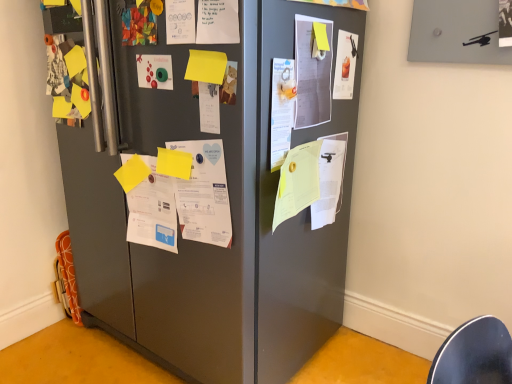
Identify the location of yellow matte paper at upper center, the fourth paper viewed from the left. Image resolution: width=512 pixels, height=384 pixels. (206, 66).

At what (x,y) coordinates should I click in order to perform the action: click on white paper at right, marked as the sixth paper in a left-to-right arrangement. Please return your answer as a coordinate pair (x, y). This screenshot has height=384, width=512. Looking at the image, I should click on (329, 180).

Identify the location of matte paper poster at upper right, the 1th poster positioned from the right. The width and height of the screenshot is (512, 384). (345, 65).

Describe the element at coordinates (179, 196) in the screenshot. The image size is (512, 384). I see `white paper at center, placed as the sixth poster when sorted from right to left` at that location.

This screenshot has height=384, width=512. Describe the element at coordinates (217, 22) in the screenshot. I see `white paper at center, the 4th poster from the right` at that location.

Where is `yellow matte paper at upper center, the third paper in the right-to-left sequence`? yellow matte paper at upper center, the third paper in the right-to-left sequence is located at coordinates (206, 66).

Which of these two, white paper at center, the sixth poster viewed from the left, or white paper at upper center, marked as the 7th poster in a right-to-left arrangement, is thinner?

white paper at center, the sixth poster viewed from the left, is thinner.

Is white paper at center, placed as the third poster when sorted from right to left, turned away from white paper at upper center, marked as the 7th poster in a right-to-left arrangement?

white paper at center, placed as the third poster when sorted from right to left, is not turned away from white paper at upper center, marked as the 7th poster in a right-to-left arrangement.

How different are the orientations of white paper at center, the sixth poster viewed from the left, and white paper at upper center, positioned as the 2th poster in left-to-right order, in degrees?

The angle between the facing direction of white paper at center, the sixth poster viewed from the left, and the facing direction of white paper at upper center, positioned as the 2th poster in left-to-right order, is 86.4 degrees.

In terms of height, does white paper at center, the sixth poster viewed from the left, look taller or shorter compared to white paper at upper center, marked as the 7th poster in a right-to-left arrangement?

Clearly, white paper at center, the sixth poster viewed from the left, is taller compared to white paper at upper center, marked as the 7th poster in a right-to-left arrangement.

Is point (334, 152) behind point (141, 204)?

Yes, it is.

Considering the sizes of white paper at right, marked as the sixth paper in a left-to-right arrangement, and white paper at center, marked as the 2th paper in a left-to-right arrangement, in the image, is white paper at right, marked as the sixth paper in a left-to-right arrangement, taller or shorter than white paper at center, marked as the 2th paper in a left-to-right arrangement,?

Clearly, white paper at right, marked as the sixth paper in a left-to-right arrangement, is taller compared to white paper at center, marked as the 2th paper in a left-to-right arrangement.

Is white paper at right, marked as the sixth paper in a left-to-right arrangement, oriented away from white paper at center, marked as the 2th paper in a left-to-right arrangement?

white paper at right, marked as the sixth paper in a left-to-right arrangement, is not turned away from white paper at center, marked as the 2th paper in a left-to-right arrangement.

Looking at this image, would you say white paper at right, marked as the sixth paper in a left-to-right arrangement, contains white paper at center, arranged as the fifth paper when viewed from the right?

No, white paper at center, arranged as the fifth paper when viewed from the right, is located outside of white paper at right, marked as the sixth paper in a left-to-right arrangement.

Which point is more forward, (x=209, y=73) or (x=318, y=27)?

The point (x=209, y=73) is in front.

Considering the sizes of objects yellow matte paper at upper center, the third paper in the right-to-left sequence, and yellow paper at upper center in the image provided, who is shorter, yellow matte paper at upper center, the third paper in the right-to-left sequence, or yellow paper at upper center?

yellow paper at upper center.

The image size is (512, 384). What are the coordinates of `note above the yellow matte paper at upper center, the fourth paper viewed from the left (from the image's perspective)` in the screenshot? It's located at (321, 37).

From a real-world perspective, is yellow matte paper at upper center, the fourth paper viewed from the left, on yellow paper at upper center?

No, from a real-world perspective, yellow matte paper at upper center, the fourth paper viewed from the left, is not on top of yellow paper at upper center.

Consider the image. Which of these two, yellow matte paper at center, the 3th paper when ordered from left to right, or white paper at center, placed as the third poster when sorted from right to left, is thinner?

Thinner between the two is white paper at center, placed as the third poster when sorted from right to left.

Considering the positions of objects yellow matte paper at center, the 3th paper when ordered from left to right, and white paper at center, the sixth poster viewed from the left, in the image provided, who is more to the left, yellow matte paper at center, the 3th paper when ordered from left to right, or white paper at center, the sixth poster viewed from the left,?

From the viewer's perspective, yellow matte paper at center, the 3th paper when ordered from left to right, appears more on the left side.

Is yellow matte paper at center, placed as the 4th paper when sorted from right to left, oriented towards white paper at center, the sixth poster viewed from the left?

No, yellow matte paper at center, placed as the 4th paper when sorted from right to left, is not turned towards white paper at center, the sixth poster viewed from the left.

From the image's perspective, does white paper at center, the sixth poster viewed from the left, appear lower than matte paper poster at upper right, the 1th poster positioned from the right?

Yes, from the image's perspective, white paper at center, the sixth poster viewed from the left, is beneath matte paper poster at upper right, the 1th poster positioned from the right.

Looking at the image, does white paper at center, placed as the third poster when sorted from right to left, seem bigger or smaller compared to matte paper poster at upper right, the 1th poster positioned from the right?

Considering their sizes, white paper at center, placed as the third poster when sorted from right to left, takes up more space than matte paper poster at upper right, the 1th poster positioned from the right.

This screenshot has height=384, width=512. In order to click on the 4th poster in front of the matte paper poster at upper right, the 1th poster positioned from the right, starting your count from the anchor in this screenshot , I will do `click(282, 110)`.

From a real-world perspective, relative to yellow paper at center, the 2th paper positioned from the right, is white paper at center, which is the fourth poster from left to right, vertically above or below?

In terms of real-world spatial position, white paper at center, which is the fourth poster from left to right, is above yellow paper at center, the 2th paper positioned from the right.

Looking at their sizes, would you say white paper at center, which is the fourth poster from left to right, is wider or thinner than yellow paper at center, the 2th paper positioned from the right?

Considering their sizes, white paper at center, which is the fourth poster from left to right, looks slimmer than yellow paper at center, the 2th paper positioned from the right.

Would you say white paper at center, arranged as the fifth poster when viewed from the right, is inside or outside yellow paper at center, the 2th paper positioned from the right?

white paper at center, arranged as the fifth poster when viewed from the right, is not inside yellow paper at center, the 2th paper positioned from the right, it's outside.

Starting from the yellow paper at center, which appears as the fifth paper when viewed from the left, which poster is the 3rd one to the left? Please provide its 2D coordinates.

[(209, 107)]

What's the angular difference between white paper at right, marked as the sixth paper in a left-to-right arrangement, and white paper at center, which appears as the seventh poster when viewed from the left,'s facing directions?

The angle between the facing direction of white paper at right, marked as the sixth paper in a left-to-right arrangement, and the facing direction of white paper at center, which appears as the seventh poster when viewed from the left, is 0.0118 degrees.

Which is further, (330, 171) or (311, 78)?

The point (330, 171) is farther from the camera.

From the image's perspective, starting from the white paper at center, which appears as the seventh poster when viewed from the left, which paper is the 4th one below? Please provide its 2D coordinates.

[(329, 180)]

From the white paper at upper center, positioned as the 2th poster in left-to-right order, count 4th poster to the right and point to it. Please provide its 2D coordinates.

[(282, 110)]

At what (x,y) coordinates should I click in order to perform the action: click on paper that is the 2nd object located in front of the white paper at right, the first paper positioned from the right. Please return your answer as a coordinate pair (x, y). Looking at the image, I should click on (153, 210).

Considering their positions, is white paper at center, placed as the third poster when sorted from right to left, positioned closer to yellow matte paper at upper center, the fourth paper viewed from the left, than yellow paper at upper center?

white paper at center, placed as the third poster when sorted from right to left, is positioned closer to the anchor yellow matte paper at upper center, the fourth paper viewed from the left.

In the scene shown: Considering their positions, is white paper at upper center, marked as the 7th poster in a right-to-left arrangement, positioned further to yellow paper at upper center than yellow matte paper at upper center, the third paper in the right-to-left sequence?

The object further to yellow paper at upper center is white paper at upper center, marked as the 7th poster in a right-to-left arrangement.

Based on their spatial positions, is white paper at center, which appears as the seventh poster when viewed from the left, or white paper at center, which is the fourth poster from left to right, further from white paper at right, marked as the sixth paper in a left-to-right arrangement?

white paper at center, which is the fourth poster from left to right, lies further to white paper at right, marked as the sixth paper in a left-to-right arrangement, than the other object.

Estimate the real-world distances between objects in this image. Which object is further from white paper at upper center, marked as the 7th poster in a right-to-left arrangement, white paper at center, placed as the sixth poster when sorted from right to left, or yellow paper at upper center?

Among the two, white paper at center, placed as the sixth poster when sorted from right to left, is located further to white paper at upper center, marked as the 7th poster in a right-to-left arrangement.

Estimate the real-world distances between objects in this image. Which object is further from white paper at center, arranged as the fifth poster when viewed from the right, matte green button at center, which is the 1th poster in left-to-right order, or yellow matte paper at upper center, the third paper in the right-to-left sequence?

Based on the image, matte green button at center, which is the 1th poster in left-to-right order, appears to be further to white paper at center, arranged as the fifth poster when viewed from the right.

Considering their positions, is white paper at center, the sixth poster viewed from the left, positioned closer to white paper at right, the first paper positioned from the right, than yellow matte paper at center-left, placed as the 6th paper when sorted from right to left?

white paper at center, the sixth poster viewed from the left, is positioned closer to the anchor white paper at right, the first paper positioned from the right.

When comparing their distances from yellow paper at upper center, does matte green button at center, which is the 1th poster in left-to-right order, or white paper at center, which is the third poster in left-to-right order, seem further?

white paper at center, which is the third poster in left-to-right order.

Estimate the real-world distances between objects in this image. Which object is closer to yellow matte paper at center, the 3th paper when ordered from left to right, white paper at center, arranged as the 2th poster when viewed from the right, or yellow matte paper at upper center, the third paper in the right-to-left sequence?

Among the two, yellow matte paper at upper center, the third paper in the right-to-left sequence, is located nearer to yellow matte paper at center, the 3th paper when ordered from left to right.

The image size is (512, 384). Find the location of `note situated between white paper at upper center, marked as the 7th poster in a right-to-left arrangement, and white paper at right, marked as the sixth paper in a left-to-right arrangement, from left to right`. note situated between white paper at upper center, marked as the 7th poster in a right-to-left arrangement, and white paper at right, marked as the sixth paper in a left-to-right arrangement, from left to right is located at coordinates (321, 37).

Locate an element on the screen. note between white paper at center, which is the fourth poster from left to right, and matte paper poster at upper right, acting as the 8th poster starting from the left, from left to right is located at coordinates (321, 37).

Where is `note between yellow matte paper at center-left, placed as the 6th paper when sorted from right to left, and white paper at right, the first paper positioned from the right`? The height and width of the screenshot is (384, 512). note between yellow matte paper at center-left, placed as the 6th paper when sorted from right to left, and white paper at right, the first paper positioned from the right is located at coordinates (321, 37).

You are a GUI agent. You are given a task and a screenshot of the screen. Output one action in this format:
    pyautogui.click(x=<x>, y=<y>)
    Task: Click on the paper between matte green button at center, acting as the eighth poster starting from the right, and yellow matte paper at center, placed as the 4th paper when sorted from right to left, in the up-down direction
    
    Given the screenshot: What is the action you would take?
    pyautogui.click(x=206, y=66)